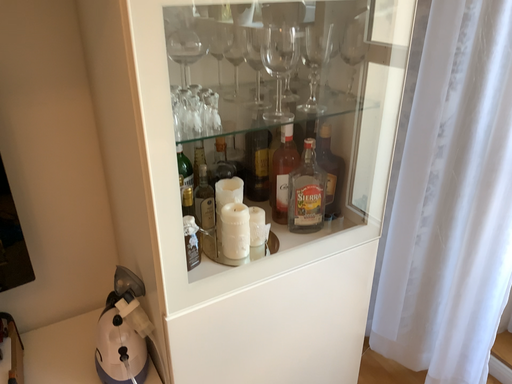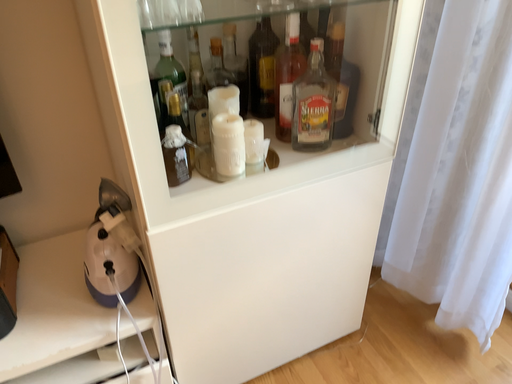
Question: Which way did the camera rotate in the video?

Choices:
 (A) rotated downward
 (B) rotated upward

Answer: (A)